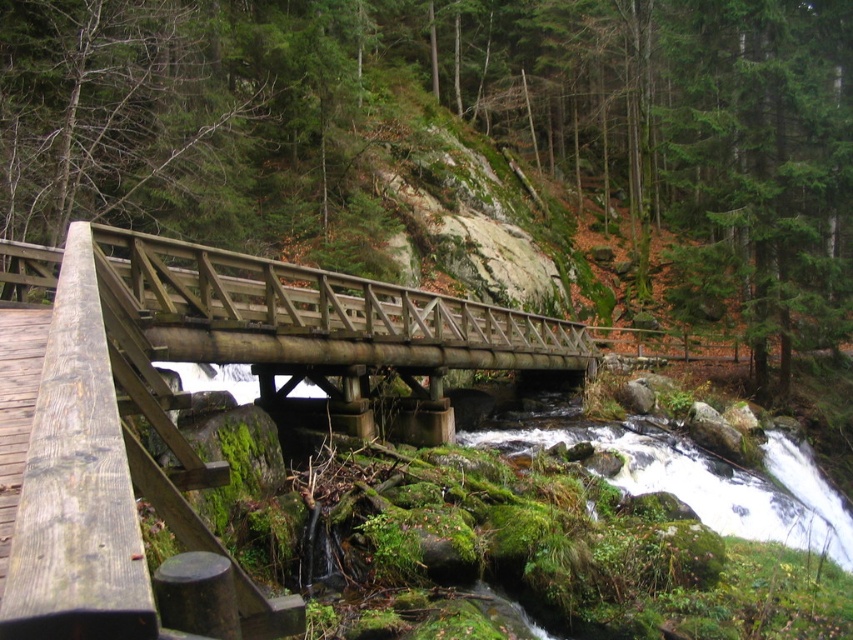
Question: Is green mossy rocks at center below weathered wood foot bridge at center?

Choices:
 (A) yes
 (B) no

Answer: (B)

Question: Which point is closer to the camera taking this photo?

Choices:
 (A) (740, 246)
 (B) (305, 408)

Answer: (B)

Question: Which point appears farthest from the camera in this image?

Choices:
 (A) (780, 243)
 (B) (393, 356)

Answer: (A)

Question: Where is green mossy rocks at center located in relation to weathered wood foot bridge at center in the image?

Choices:
 (A) above
 (B) below

Answer: (A)

Question: Is green mossy rocks at center positioned at the back of weathered wood foot bridge at center?

Choices:
 (A) yes
 (B) no

Answer: (A)